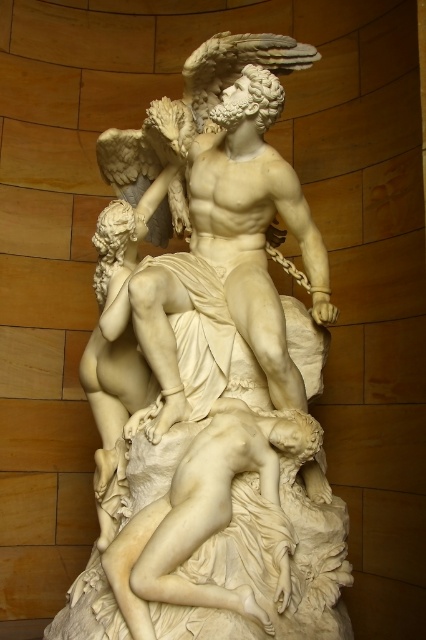
Question: Does white marble sculpture at center have a smaller size compared to white marble nude at center?

Choices:
 (A) no
 (B) yes

Answer: (A)

Question: Among these points, which one is nearest to the camera?

Choices:
 (A) (265, 531)
 (B) (222, 152)

Answer: (A)

Question: Which object appears farthest from the camera in this image?

Choices:
 (A) white marble sculpture at center
 (B) white marble nude at center

Answer: (B)

Question: Does white marble sculpture at center appear on the right side of white marble nude at center?

Choices:
 (A) yes
 (B) no

Answer: (B)

Question: Is white marble sculpture at center thinner than white marble nude at center?

Choices:
 (A) no
 (B) yes

Answer: (A)

Question: Which point is closer to the camera taking this photo?

Choices:
 (A) (112, 378)
 (B) (187, 480)

Answer: (B)